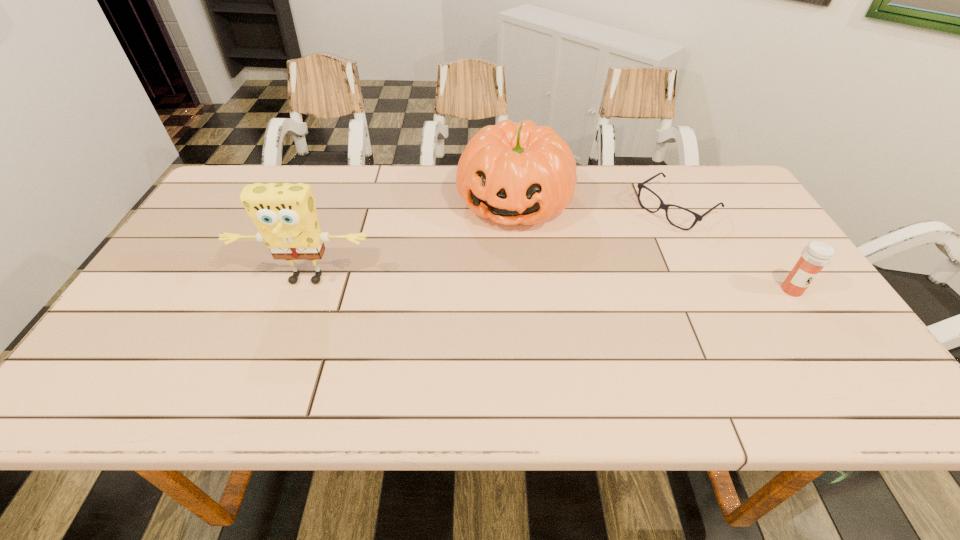
The width and height of the screenshot is (960, 540). Identify the location of free space at the near edge of the desktop. pos(378,343).

At what (x,y) coordinates should I click in order to perform the action: click on free space at the left edge of the desktop. Please return your answer as a coordinate pair (x, y). This screenshot has width=960, height=540. Looking at the image, I should click on (173, 332).

You are a GUI agent. You are given a task and a screenshot of the screen. Output one action in this format:
    pyautogui.click(x=<x>, y=<y>)
    Task: Click on the vacant area at the right edge of the desktop
    The width and height of the screenshot is (960, 540).
    Given the screenshot: What is the action you would take?
    pyautogui.click(x=745, y=210)

You are a GUI agent. You are given a task and a screenshot of the screen. Output one action in this format:
    pyautogui.click(x=<x>, y=<y>)
    Task: Click on the free region at the near left corner of the desktop
    This screenshot has width=960, height=540.
    Given the screenshot: What is the action you would take?
    pyautogui.click(x=115, y=357)

The width and height of the screenshot is (960, 540). What are the coordinates of `free space at the far right corner of the desktop` in the screenshot? It's located at click(x=706, y=205).

In the image, there is a desktop. At what (x,y) coordinates should I click in order to perform the action: click on free space at the near right corner. Please return your answer as a coordinate pair (x, y). Looking at the image, I should click on point(793,355).

I want to click on free spot between the second object from left to right and the medicine, so click(653, 246).

What are the coordinates of `empty space that is in between the shortest object and the pumpkin` in the screenshot? It's located at (595, 205).

You are a GUI agent. You are given a task and a screenshot of the screen. Output one action in this format:
    pyautogui.click(x=<x>, y=<y>)
    Task: Click on the blank region between the third object from left to right and the third object from right to left
    This screenshot has width=960, height=540.
    Given the screenshot: What is the action you would take?
    pyautogui.click(x=595, y=205)

This screenshot has height=540, width=960. I want to click on free space between the leftmost object and the shortest object, so click(x=492, y=244).